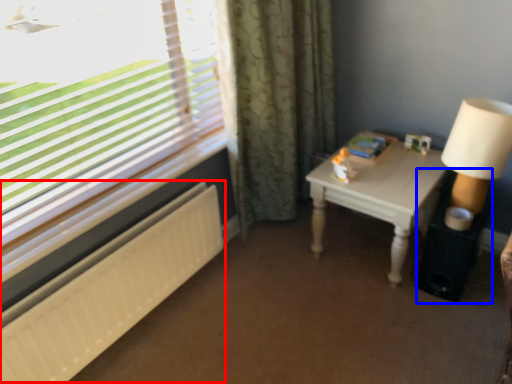
Question: Among these objects, which one is nearest to the camera, radiator (highlighted by a red box) or side table (highlighted by a blue box)?

Choices:
 (A) radiator
 (B) side table

Answer: (A)